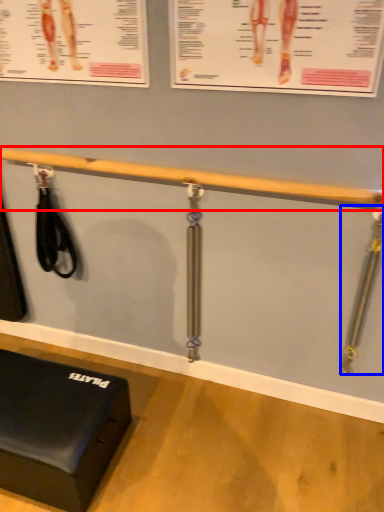
Question: Among these objects, which one is farthest to the camera, beam (highlighted by a red box) or tool (highlighted by a blue box)?

Choices:
 (A) beam
 (B) tool

Answer: (B)